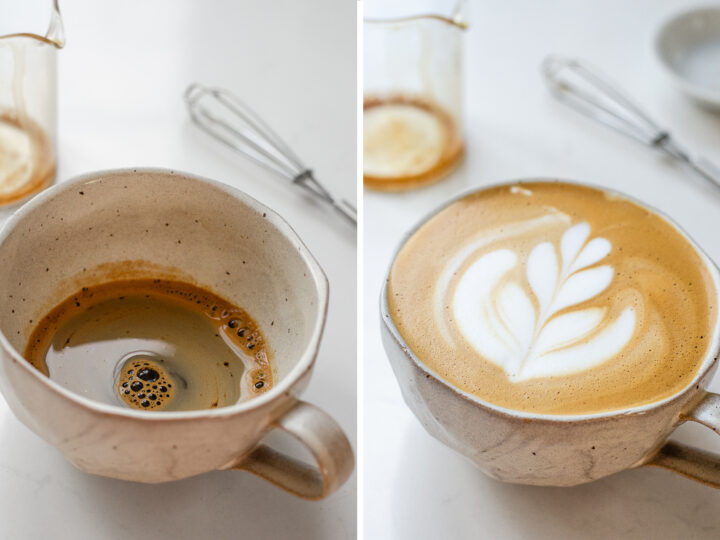
Identify the location of handle. Image resolution: width=720 pixels, height=540 pixels. (706, 414), (337, 469).